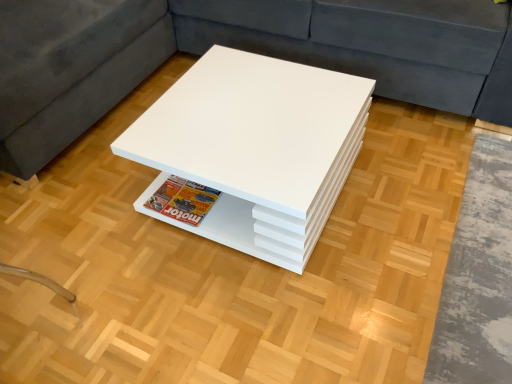
I want to click on free space on the front side of white glossy table at center, so click(257, 313).